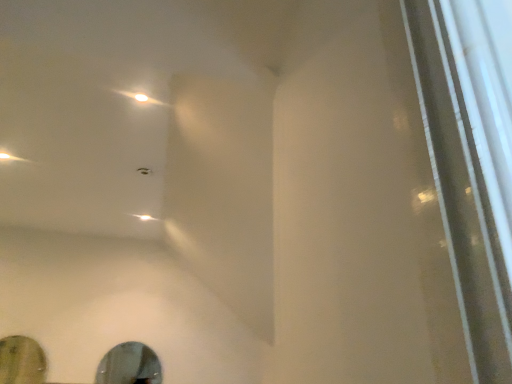
Question: In terms of height, does shiny silver mirror at lower center, acting as the 1th mirror starting from the right, look taller or shorter compared to green matte mirror at lower left, the second mirror from the right?

Choices:
 (A) short
 (B) tall

Answer: (A)

Question: Relative to green matte mirror at lower left, the second mirror from the right, is shiny silver mirror at lower center, which is counted as the 2th mirror, starting from the left, in front or behind?

Choices:
 (A) front
 (B) behind

Answer: (B)

Question: Looking at their shapes, would you say shiny silver mirror at lower center, which is counted as the 2th mirror, starting from the left, is wider or thinner than green matte mirror at lower left, the second mirror from the right?

Choices:
 (A) thin
 (B) wide

Answer: (A)

Question: Visually, is green matte mirror at lower left, the second mirror from the right, positioned to the left or to the right of shiny silver mirror at lower center, acting as the 1th mirror starting from the right?

Choices:
 (A) right
 (B) left

Answer: (B)

Question: Is green matte mirror at lower left, arranged as the 1th mirror when viewed from the left, bigger or smaller than shiny silver mirror at lower center, acting as the 1th mirror starting from the right?

Choices:
 (A) small
 (B) big

Answer: (B)

Question: In terms of height, does green matte mirror at lower left, the second mirror from the right, look taller or shorter compared to shiny silver mirror at lower center, acting as the 1th mirror starting from the right?

Choices:
 (A) short
 (B) tall

Answer: (B)

Question: Is green matte mirror at lower left, the second mirror from the right, spatially inside shiny silver mirror at lower center, which is counted as the 2th mirror, starting from the left, or outside of it?

Choices:
 (A) outside
 (B) inside

Answer: (A)